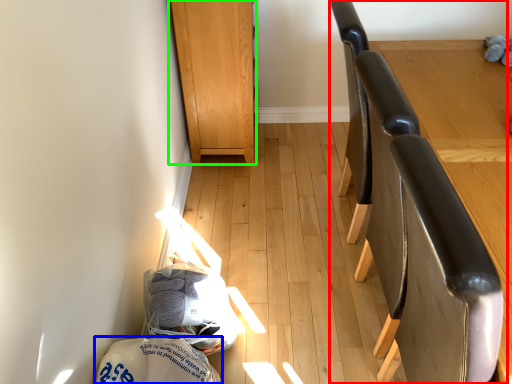
Question: Based on their relative distances, which object is farther from chair (highlighted by a red box)? Choose from material (highlighted by a blue box) and furniture (highlighted by a green box).

Choices:
 (A) material
 (B) furniture

Answer: (B)